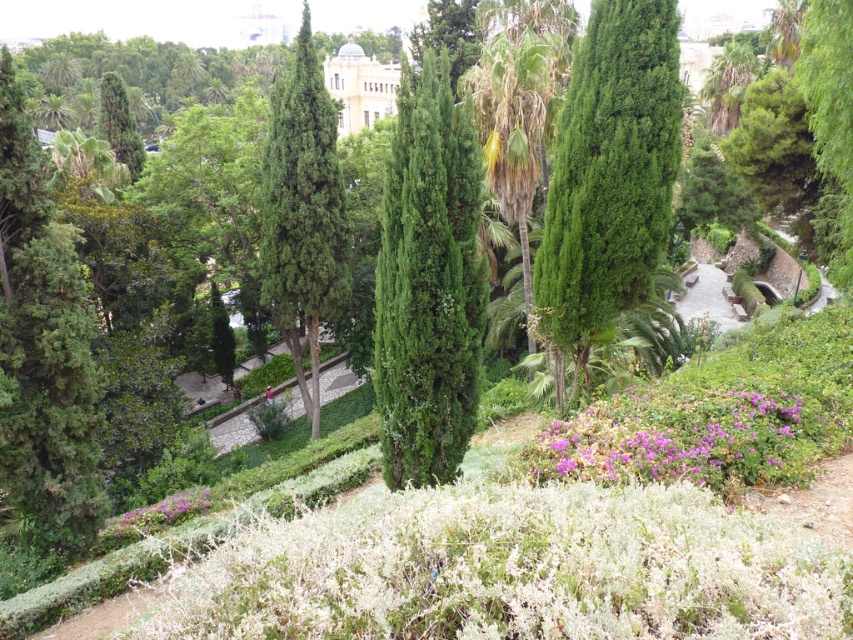
Can you confirm if green textured cypress at center is positioned to the left of green textured palm tree at center?

Yes, green textured cypress at center is to the left of green textured palm tree at center.

Is green textured cypress at center thinner than green textured palm tree at center?

Indeed, green textured cypress at center has a lesser width compared to green textured palm tree at center.

Is point (335, 275) positioned after point (514, 26)?

No, it is in front of (514, 26).

Find the location of `green textured cypress at center`. green textured cypress at center is located at coordinates (303, 211).

Does green needle-like at center appear on the right side of green textured palm tree at center?

Indeed, green needle-like at center is positioned on the right side of green textured palm tree at center.

Does green needle-like at center come in front of green textured palm tree at center?

Yes, it is in front of green textured palm tree at center.

Between point (602, 269) and point (531, 186), which one is positioned in front?

Point (602, 269) is more forward.

Image resolution: width=853 pixels, height=640 pixels. In order to click on green needle-like at center in this screenshot , I will do `click(608, 173)`.

Between green needle-like at center and purple matte flowers at center, which one is positioned lower?

purple matte flowers at center is lower down.

Measure the distance between green needle-like at center and camera.

green needle-like at center and camera are 15.64 meters apart from each other.

Image resolution: width=853 pixels, height=640 pixels. I want to click on green needle-like at center, so click(x=608, y=173).